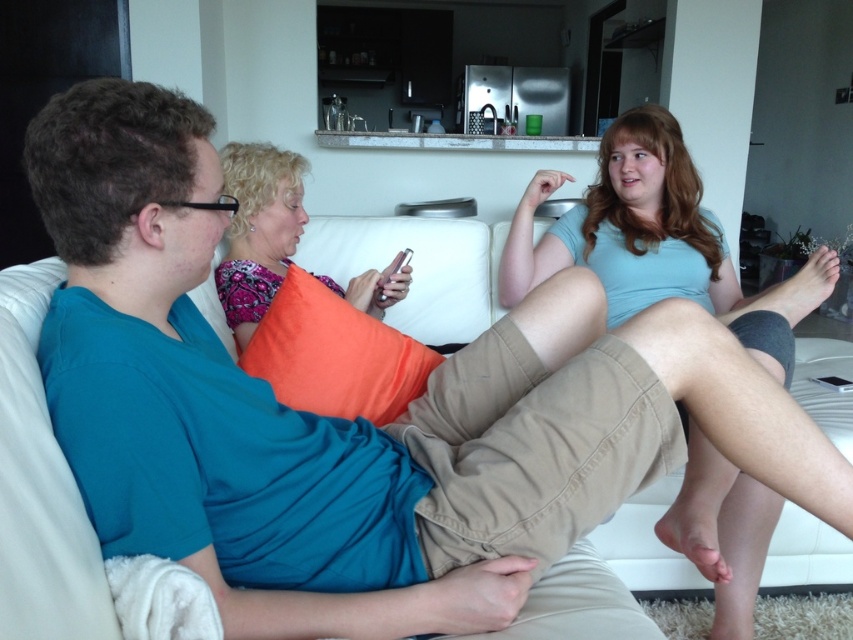
You are standing in front of the couch and want to hand a book to the person wearing the matte blue shirt at upper right. If your arm can reach 0.8 meters, can you reach them?

The matte blue shirt at upper right is 1.09 meters away from the camera, so your arm can only reach 0.8 meters. You cannot reach them.

You are trying to decide whether to place a new book on the shelf above the matte blue shirt at upper right or the patterned fabric pillow at center. Based on their heights, which one would allow the book to be placed higher?

The matte blue shirt at upper right has a greater height compared to the patterned fabric pillow at center, so placing the book above the matte blue shirt at upper right would allow it to be placed higher.